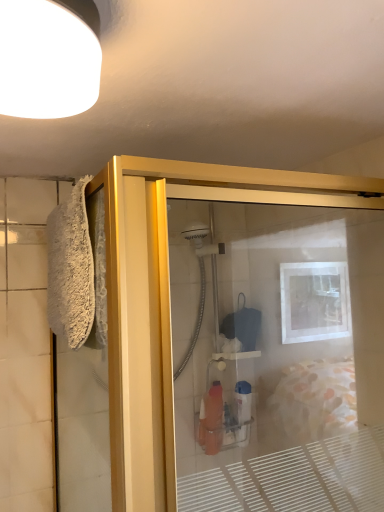
Question: From a real-world perspective, is gold metallic shower door at left above or below white fluffy bath towel at left?

Choices:
 (A) above
 (B) below

Answer: (B)

Question: From the image's perspective, is gold metallic shower door at left above or below white fluffy bath towel at left?

Choices:
 (A) below
 (B) above

Answer: (A)

Question: Which object is the closest to the gold metallic shower door at left?

Choices:
 (A) white fluffy bath towel at left
 (B) white matte light fixture at upper left

Answer: (A)

Question: Considering the real-world distances, which object is farthest from the white matte light fixture at upper left?

Choices:
 (A) gold metallic shower door at left
 (B) white fluffy bath towel at left

Answer: (A)